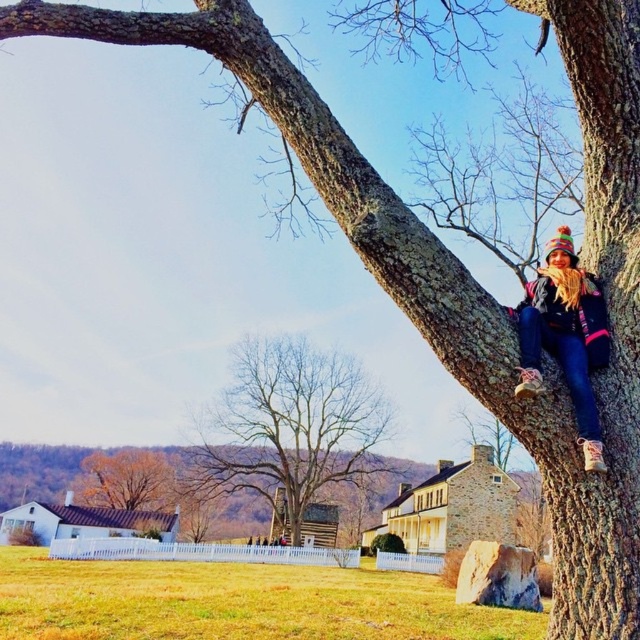
Question: Does brown rough tree at center have a smaller size compared to golden brown leaves at lower left?

Choices:
 (A) no
 (B) yes

Answer: (A)

Question: Does smooth bark tree trunk at right have a lesser width compared to multicolored knitted hat at upper right?

Choices:
 (A) yes
 (B) no

Answer: (B)

Question: Does multicolored knitted hat at upper right lie behind golden brown leaves at lower left?

Choices:
 (A) no
 (B) yes

Answer: (A)

Question: Among these objects, which one is nearest to the camera?

Choices:
 (A) smooth bark tree trunk at right
 (B) golden brown leaves at lower left

Answer: (A)

Question: Which object is closer to the camera taking this photo?

Choices:
 (A) golden brown leaves at lower left
 (B) brown rough tree at center
 (C) smooth bark tree trunk at right

Answer: (C)

Question: Which object is the farthest from the smooth bark tree trunk at right?

Choices:
 (A) multicolored knitted hat at upper right
 (B) golden brown leaves at lower left
 (C) brown rough tree at center

Answer: (B)